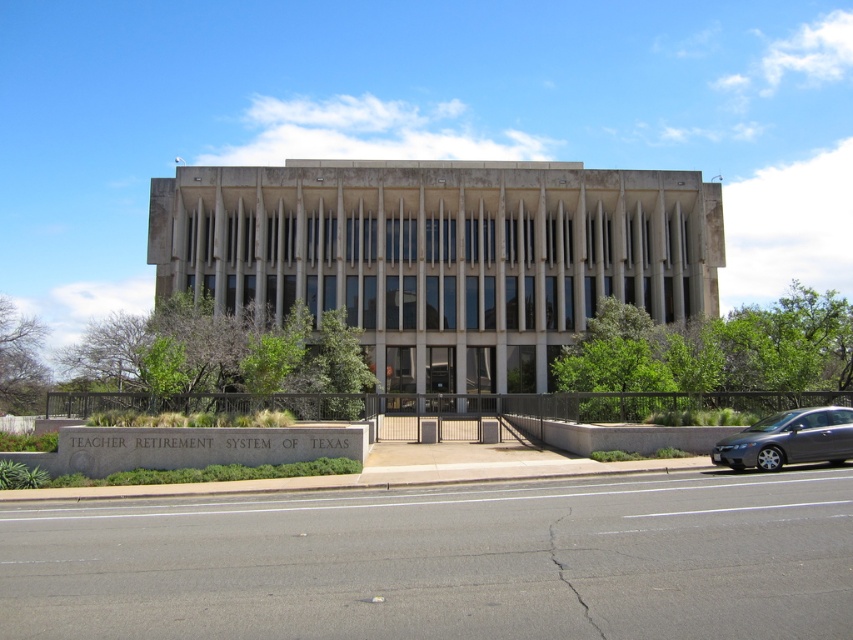
You are standing at the entrance of the building and see two points marked on the ground. The first point is labeled as point [138,508] and the second is point [799,442]. Which of these two points is closer to you?

Point [138,508] is closer to you because it is in front of point [799,442].

From the picture: You are standing in front of the building and want to walk to the asphalt at lower center. Based on the coordinates given, in which direction should you move relative to your current position?

The asphalt at lower center is located at coordinates point (444,561), so you should move towards the lower center direction to reach it.